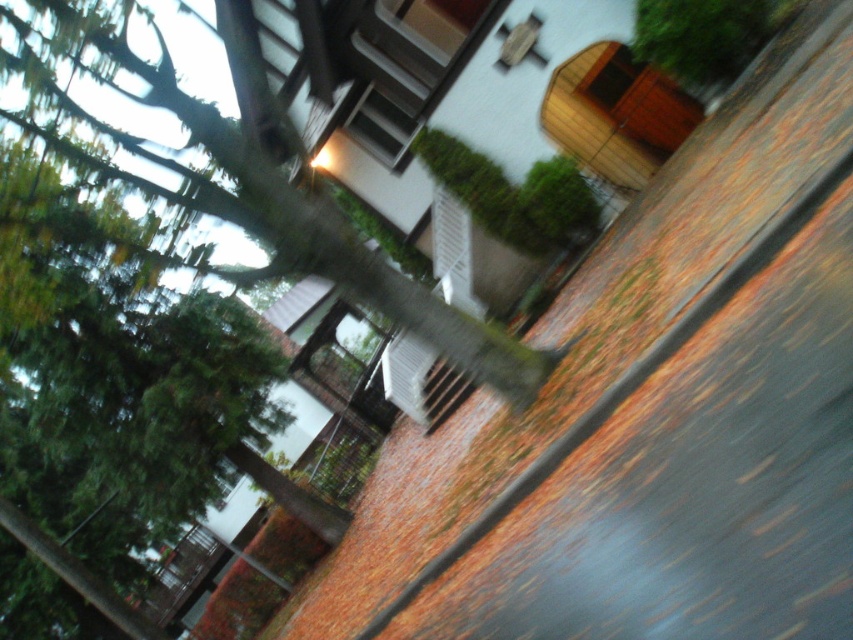
Can you confirm if green leafy tree at upper left is positioned below green leafy tree at upper right?

Indeed, green leafy tree at upper left is positioned under green leafy tree at upper right.

Between point (471, 332) and point (700, 86), which one is positioned behind?

The point (700, 86) is behind.

At what (x,y) coordinates should I click in order to perform the action: click on green leafy tree at upper left. Please return your answer as a coordinate pair (x, y). The width and height of the screenshot is (853, 640). Looking at the image, I should click on (288, 216).